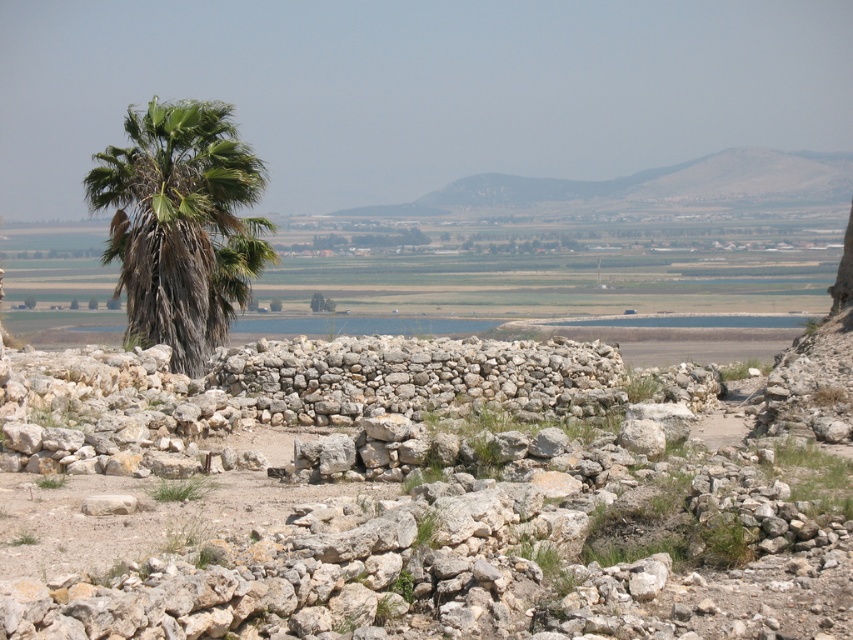
Does gray stone wall at center appear under green leafy palm at left?

Yes, gray stone wall at center is below green leafy palm at left.

The width and height of the screenshot is (853, 640). What do you see at coordinates (428, 497) in the screenshot?
I see `gray stone wall at center` at bounding box center [428, 497].

You are a GUI agent. You are given a task and a screenshot of the screen. Output one action in this format:
    pyautogui.click(x=<x>, y=<y>)
    Task: Click on the gray stone wall at center
    The image size is (853, 640).
    Given the screenshot: What is the action you would take?
    pyautogui.click(x=428, y=497)

Can you confirm if green leafy palm at left is wider than green leafy tree at center?

Indeed, green leafy palm at left has a greater width compared to green leafy tree at center.

Is green leafy palm at left in front of green leafy tree at center?

Yes.

Where is `green leafy palm at left`? Image resolution: width=853 pixels, height=640 pixels. green leafy palm at left is located at coordinates (180, 225).

Is gray stone wall at center smaller than green leafy tree at center?

Actually, gray stone wall at center might be larger than green leafy tree at center.

Is gray stone wall at center further to the viewer compared to green leafy tree at center?

No.

Between point (496, 540) and point (328, 307), which one is positioned in front?

Point (496, 540) is in front.

Where is `gray stone wall at center`? gray stone wall at center is located at coordinates (428, 497).